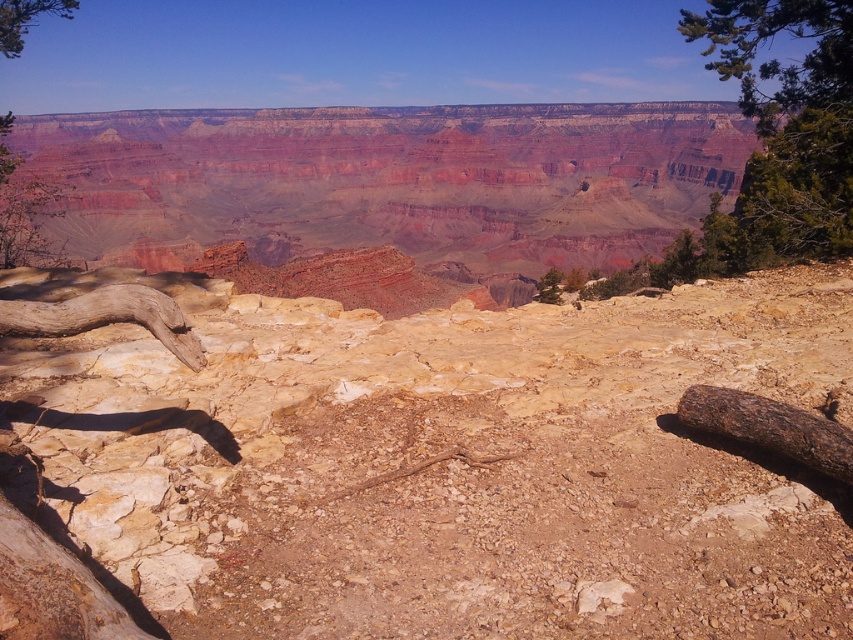
Question: Is brown rough tree trunk at left to the right of green leafy tree at upper left from the viewer's perspective?

Choices:
 (A) no
 (B) yes

Answer: (B)

Question: Considering the real-world distances, which object is farthest from the brown rough log at right?

Choices:
 (A) green textured pine tree at upper right
 (B) brown rough tree trunk at left
 (C) green leafy tree at upper left

Answer: (C)

Question: Is brown rough log at right smaller than green leafy tree at upper left?

Choices:
 (A) no
 (B) yes

Answer: (B)

Question: Based on their relative distances, which object is farther from the brown rough log at right?

Choices:
 (A) green textured pine tree at upper right
 (B) green leafy tree at upper left
 (C) brown rough tree trunk at left

Answer: (B)

Question: Which point appears farthest from the camera in this image?

Choices:
 (A) (733, 60)
 (B) (33, 4)

Answer: (B)

Question: Does brown rough tree trunk at left have a larger size compared to green leafy tree at upper left?

Choices:
 (A) no
 (B) yes

Answer: (A)